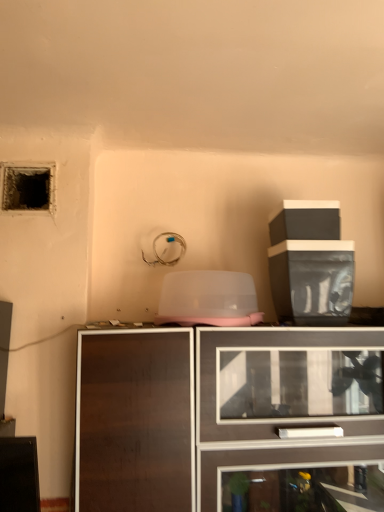
Question: From the image's perspective, is dark wood cabinet at center, the 1th cabinetry when ordered from bottom to top, above or below black plastic container at upper right, acting as the 2th cabinetry starting from the bottom?

Choices:
 (A) above
 (B) below

Answer: (B)

Question: From a real-world perspective, is dark wood cabinet at center, the 1th cabinetry when ordered from bottom to top, above or below black plastic container at upper right, placed as the 1th cabinetry when sorted from top to bottom?

Choices:
 (A) above
 (B) below

Answer: (B)

Question: Estimate the real-world distances between objects in this image. Which object is closer to the dark textured hole at upper left?

Choices:
 (A) dark wood cabinet at center, the 1th cabinetry when ordered from bottom to top
 (B) black plastic container at upper right, placed as the 1th cabinetry when sorted from top to bottom

Answer: (B)

Question: Which is nearer to the black plastic container at upper right, placed as the 1th cabinetry when sorted from top to bottom?

Choices:
 (A) dark textured hole at upper left
 (B) dark wood cabinet at center, the 1th cabinetry when ordered from bottom to top

Answer: (B)